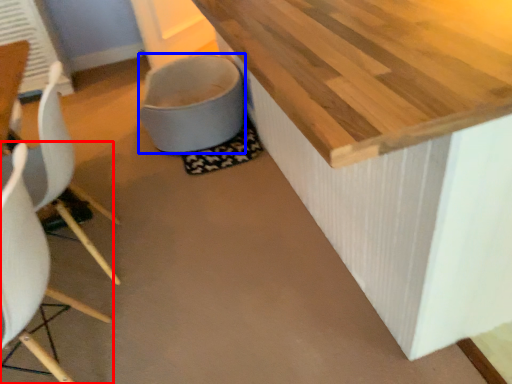
Question: Which object is closer to the camera taking this photo, chair (highlighted by a red box) or toilet bowl (highlighted by a blue box)?

Choices:
 (A) chair
 (B) toilet bowl

Answer: (A)